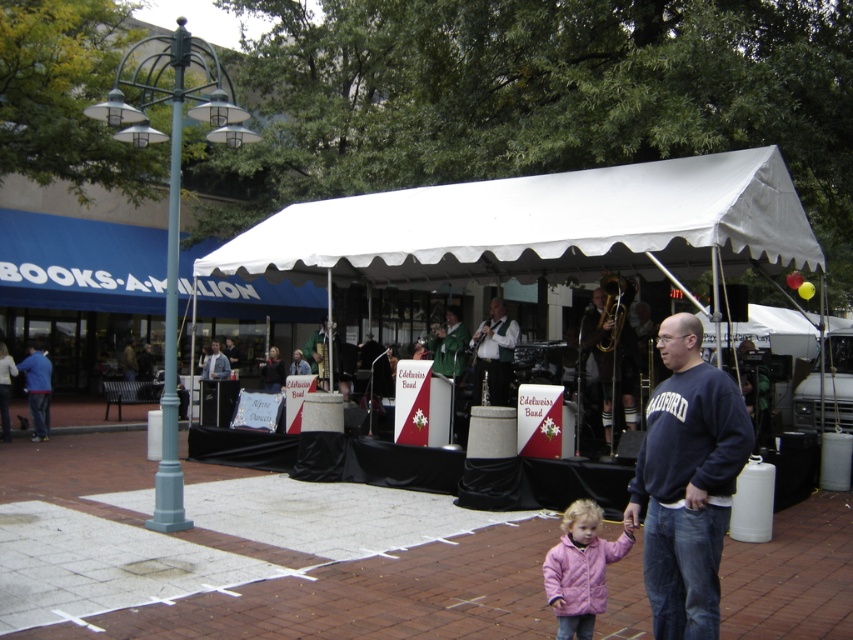
Is point (509, 365) positioned in front of point (225, 369)?

Yes, it is in front of point (225, 369).

Locate an element on the screen. shiny silver trumpet at center is located at coordinates (494, 353).

Who is more distant from viewer, (x=498, y=372) or (x=206, y=369)?

The point (x=206, y=369) is behind.

Where is `shiny silver trumpet at center`? The image size is (853, 640). shiny silver trumpet at center is located at coordinates (494, 353).

Who is more forward, (682,241) or (503,403)?

Point (682,241) is in front.

Is point (558, 186) positioned before point (485, 355)?

That is True.

This screenshot has height=640, width=853. Find the location of `white fabric canopy at center`. white fabric canopy at center is located at coordinates (538, 225).

Is point (648, 435) positioned behind point (206, 358)?

No, it is in front of (206, 358).

The height and width of the screenshot is (640, 853). In order to click on navy blue sweatshirt at lower right in this screenshot , I will do `click(688, 483)`.

Does point (717, 392) come farther from viewer compared to point (206, 365)?

No, it is not.

The width and height of the screenshot is (853, 640). In order to click on navy blue sweatshirt at lower right in this screenshot , I will do `click(688, 483)`.